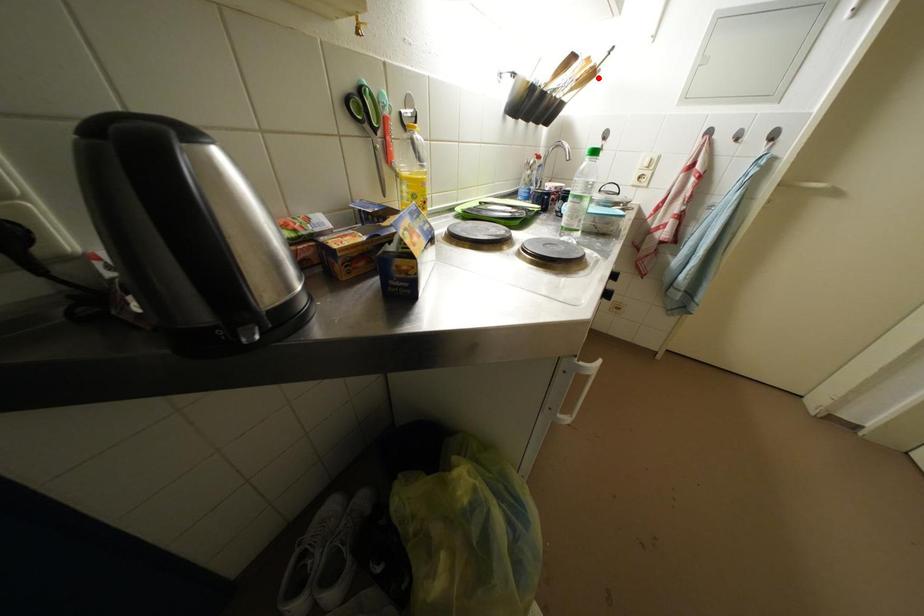
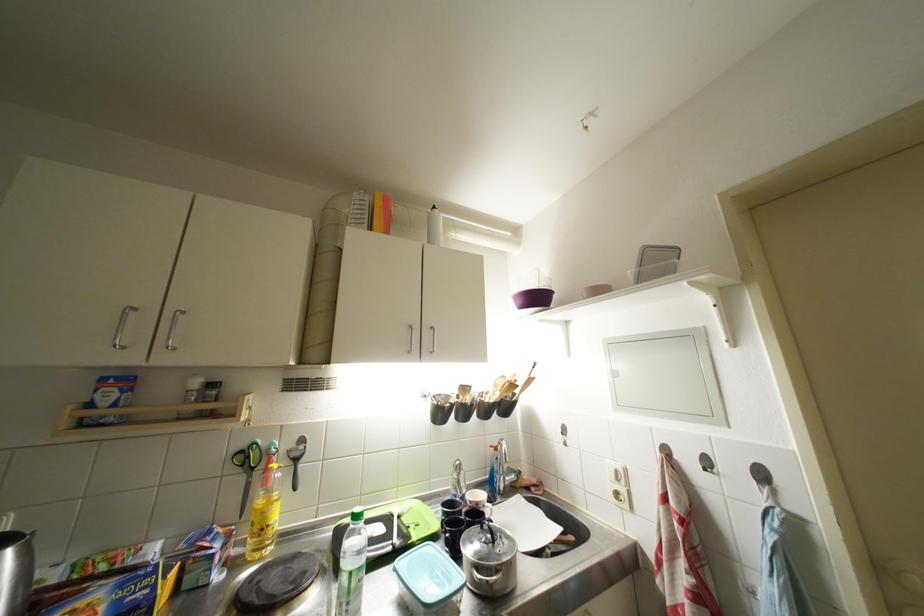
Locate, in the second image, the point that corresponds to the highlighted location in the first image.

(519, 390)